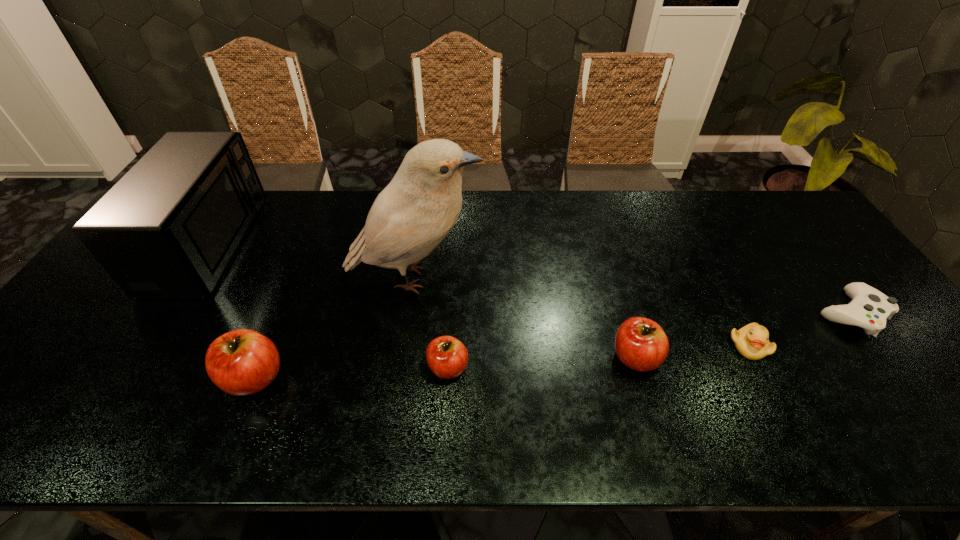
At what (x,y) coordinates should I click in order to perform the action: click on object located at the far edge. Please return your answer as a coordinate pair (x, y). The width and height of the screenshot is (960, 540). Looking at the image, I should click on (170, 226).

The height and width of the screenshot is (540, 960). What are the coordinates of `object that is at the left edge` in the screenshot? It's located at (170, 226).

This screenshot has height=540, width=960. I want to click on object located in the right edge section of the desktop, so click(869, 309).

Where is `object that is at the far left corner`? Image resolution: width=960 pixels, height=540 pixels. object that is at the far left corner is located at coordinates (170, 226).

Identify the location of vacant space at the far edge of the desktop. (673, 230).

Image resolution: width=960 pixels, height=540 pixels. I want to click on free space at the near edge, so click(x=827, y=388).

At what (x,y) coordinates should I click in order to perform the action: click on vacant region at the right edge. Please return your answer as a coordinate pair (x, y). This screenshot has width=960, height=540. Looking at the image, I should click on (904, 356).

I want to click on free space between the second apple from left to right and the fourth tallest object, so click(x=541, y=362).

Locate an element on the screen. This screenshot has width=960, height=540. vacant space in between the control and the second object from right to left is located at coordinates (800, 329).

Where is `free space between the tallest object and the microwave_oven`? free space between the tallest object and the microwave_oven is located at coordinates tap(312, 261).